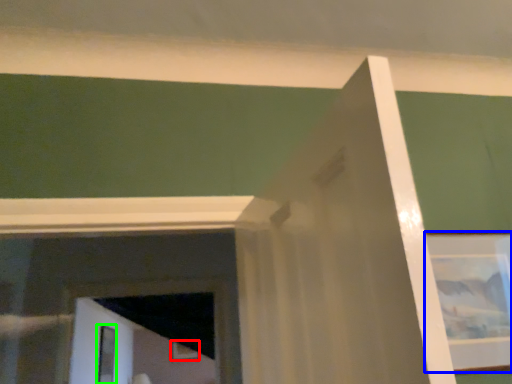
Question: Considering the real-world distances, which object is closest to picture frame (highlighted by a red box)? picture frame (highlighted by a blue box) or screen door (highlighted by a green box).

Choices:
 (A) picture frame
 (B) screen door

Answer: (B)